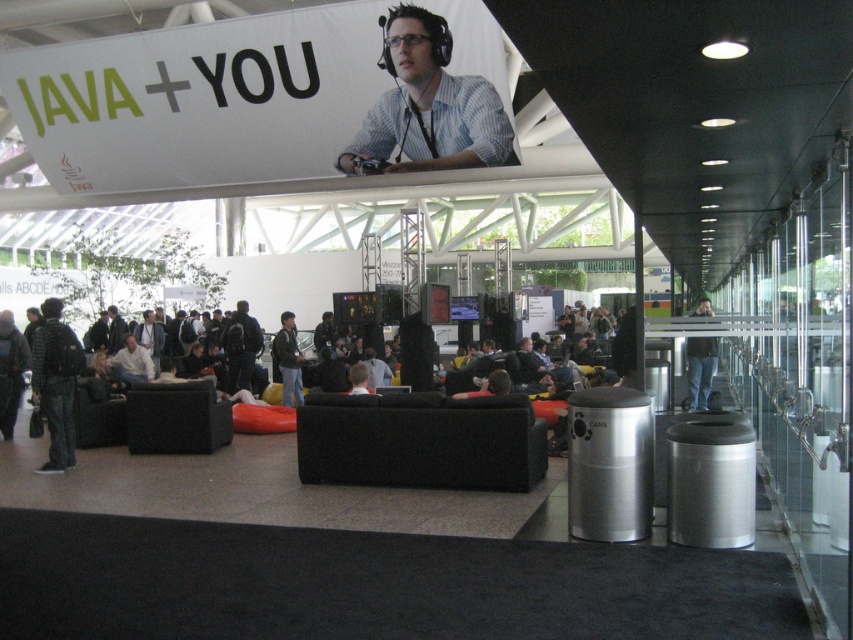
Question: Is dark blue jeans at left bigger than dark blue jacket at center?

Choices:
 (A) yes
 (B) no

Answer: (A)

Question: Can you confirm if matte black shirt at center is smaller than dark blue jacket at center?

Choices:
 (A) no
 (B) yes

Answer: (A)

Question: Among these objects, which one is farthest from the camera?

Choices:
 (A) jeans at center
 (B) matte black shirt at center

Answer: (A)

Question: Which object is the closest to the matte black shirt at center?

Choices:
 (A) dark blue jacket at center
 (B) jeans at center

Answer: (A)

Question: Considering the real-world distances, which object is farthest from the dark blue jeans at left?

Choices:
 (A) matte black shirt at center
 (B) jeans at center

Answer: (B)

Question: Does matte black shirt at center appear on the right side of dark blue jacket at center?

Choices:
 (A) yes
 (B) no

Answer: (A)